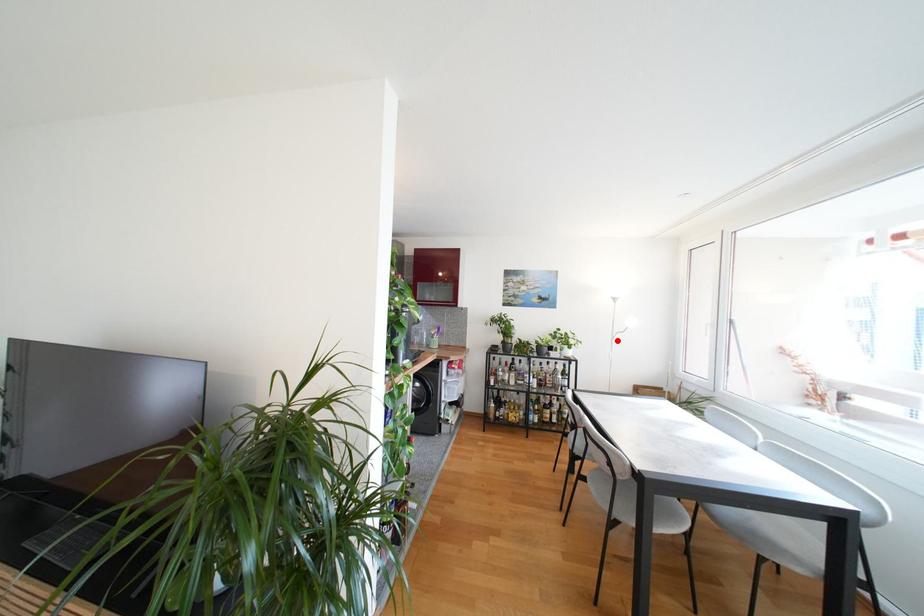
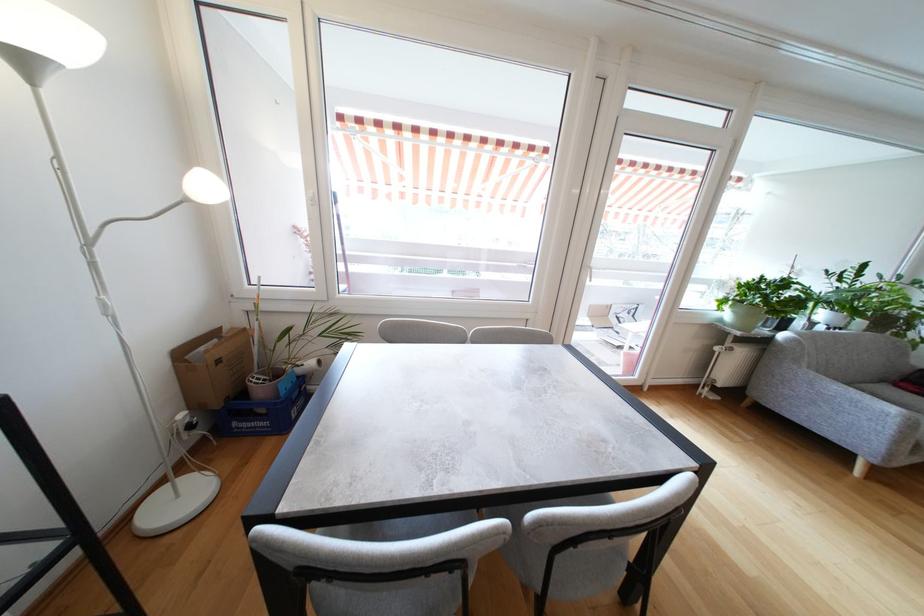
Find the pixel in the second image that matches the highlighted location in the first image.

(93, 246)